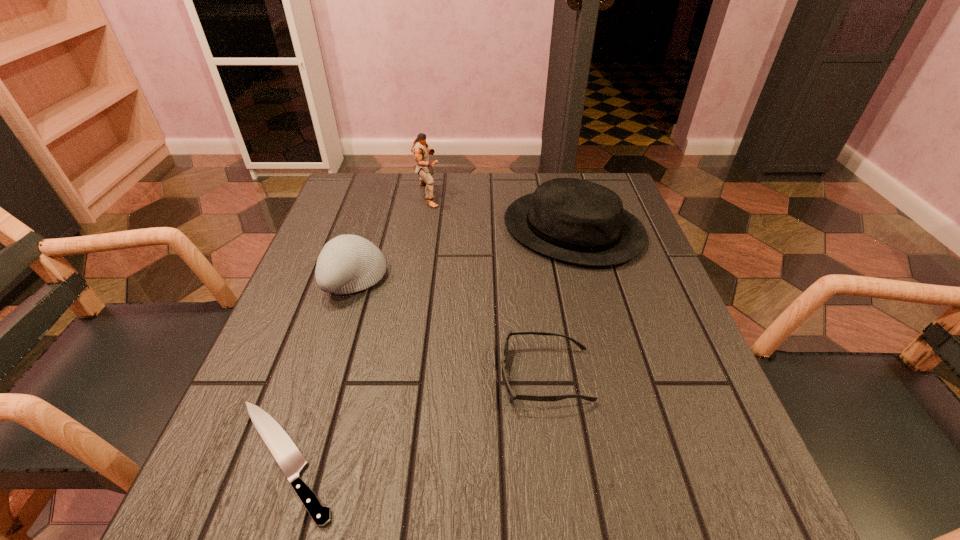
Locate an element on the screen. Image resolution: width=960 pixels, height=540 pixels. free space in the image that satisfies the following two spatial constraints: 1. on the back side of the shortest object; 2. on the right side of the beanie is located at coordinates (345, 279).

Where is `free space that satisfies the following two spatial constraints: 1. on the front-facing side of the tallest object; 2. on the front side of the beanie`? Image resolution: width=960 pixels, height=540 pixels. free space that satisfies the following two spatial constraints: 1. on the front-facing side of the tallest object; 2. on the front side of the beanie is located at coordinates (416, 279).

Where is `vacant space that satisfies the following two spatial constraints: 1. on the front-facing side of the fedora; 2. on the right side of the tallest object`? This screenshot has width=960, height=540. vacant space that satisfies the following two spatial constraints: 1. on the front-facing side of the fedora; 2. on the right side of the tallest object is located at coordinates (423, 230).